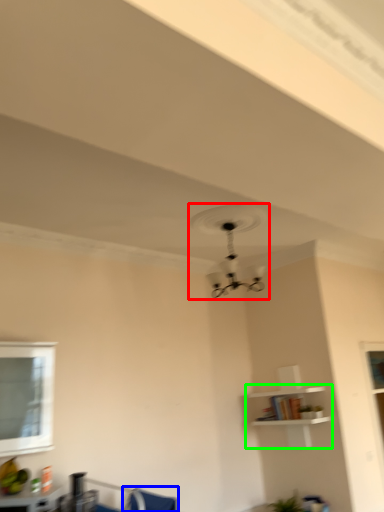
Question: Which object is the closest to the fan (highlighted by a red box)? Choose among these: swivel chair (highlighted by a blue box) or shelf (highlighted by a green box).

Choices:
 (A) swivel chair
 (B) shelf

Answer: (B)